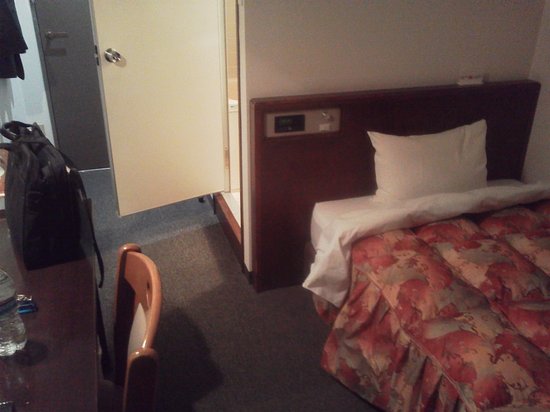
Identify the location of shadow of chair. The image size is (550, 412). 188,361.